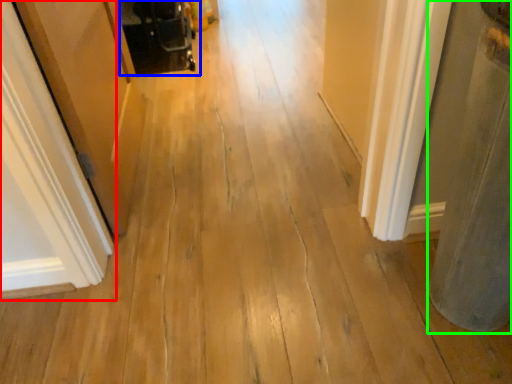
Question: Which object is the closest to the door (highlighted by a red box)? Choose among these: baby carriage (highlighted by a blue box) or pillar (highlighted by a green box).

Choices:
 (A) baby carriage
 (B) pillar

Answer: (B)